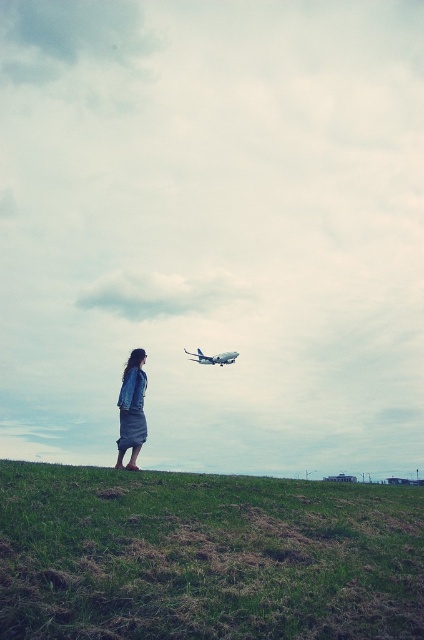
Question: Is denim jacket at lower left further to camera compared to white matte airplane at center?

Choices:
 (A) no
 (B) yes

Answer: (A)

Question: Is green grassy hill at lower center thinner than white matte airplane at center?

Choices:
 (A) no
 (B) yes

Answer: (A)

Question: Considering the real-world distances, which object is farthest from the white matte airplane at center?

Choices:
 (A) denim jacket at lower left
 (B) green grassy hill at lower center

Answer: (B)

Question: Does green grassy hill at lower center lie behind denim jacket at lower left?

Choices:
 (A) yes
 (B) no

Answer: (B)

Question: Based on their relative distances, which object is nearer to the denim jacket at lower left?

Choices:
 (A) green grassy hill at lower center
 (B) white matte airplane at center

Answer: (A)

Question: Considering the real-world distances, which object is closest to the white matte airplane at center?

Choices:
 (A) denim jacket at lower left
 (B) green grassy hill at lower center

Answer: (A)